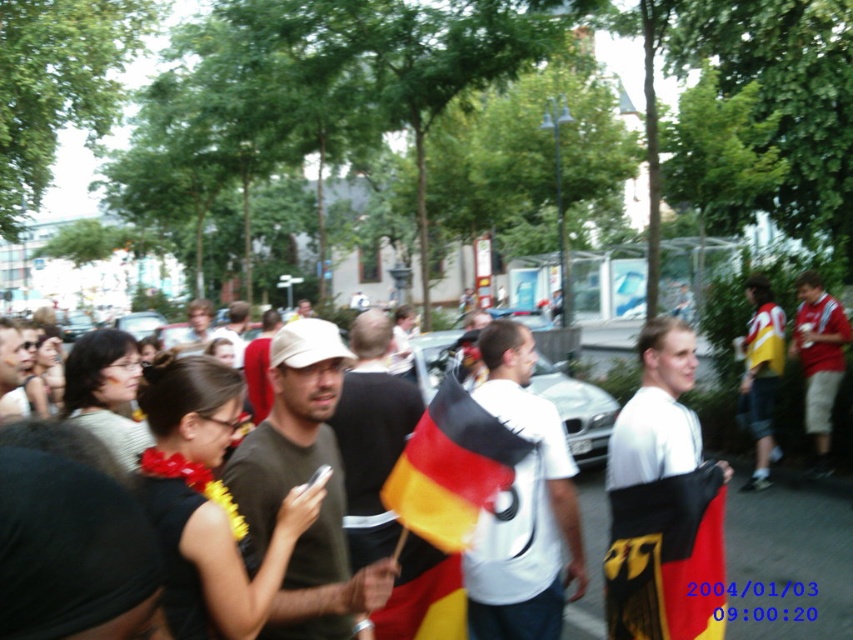
Question: Considering the real-world distances, which object is farthest from the red cotton shirt at center?

Choices:
 (A) yellow jersey at right
 (B) black and red fabric flag at center
 (C) white jersey at center
 (D) matte black shirt at center

Answer: (B)

Question: In this image, where is german flag at center located relative to polyester flag at center?

Choices:
 (A) right
 (B) left

Answer: (A)

Question: Which object is the farthest from the black and red fabric flag at center?

Choices:
 (A) yellow jersey at right
 (B) dark green t-shirt at center

Answer: (A)

Question: Based on their relative distances, which object is farther from the dark green t-shirt at center?

Choices:
 (A) yellow jersey at right
 (B) german flag at center
 (C) white jersey at center
 (D) red cotton shirt at center

Answer: (D)

Question: In this image, where is white jersey at center located relative to polyester flag at center?

Choices:
 (A) left
 (B) right

Answer: (B)

Question: Is white jersey at center further to camera compared to black and red fabric flag at center?

Choices:
 (A) no
 (B) yes

Answer: (A)